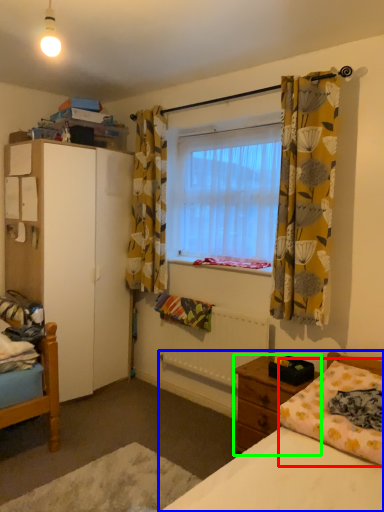
Question: Which is farther away from mattress (highlighted by a red box)? bed (highlighted by a blue box) or nightstand (highlighted by a green box)?

Choices:
 (A) bed
 (B) nightstand

Answer: (B)